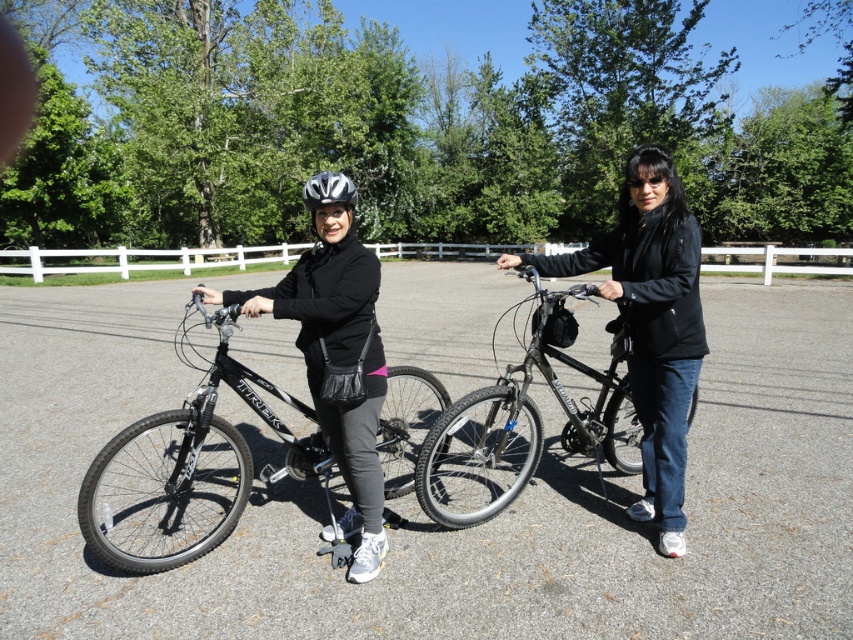
Question: Is matte black helmet at center thinner than shiny black bicycle at center?

Choices:
 (A) yes
 (B) no

Answer: (A)

Question: Which point is farther from the camera taking this photo?

Choices:
 (A) (372, 560)
 (B) (654, 196)
 (C) (189, 528)

Answer: (C)

Question: Which point is farther to the camera?

Choices:
 (A) (543, 376)
 (B) (428, 458)

Answer: (A)

Question: Is matte black bicycle at center further to camera compared to shiny black bicycle at center?

Choices:
 (A) no
 (B) yes

Answer: (A)

Question: Which of the following is the farthest from the observer?

Choices:
 (A) (368, 413)
 (B) (422, 504)
 (C) (169, 545)

Answer: (C)

Question: Is black matte bicycle at center positioned in front of shiny black bicycle at center?

Choices:
 (A) no
 (B) yes

Answer: (B)